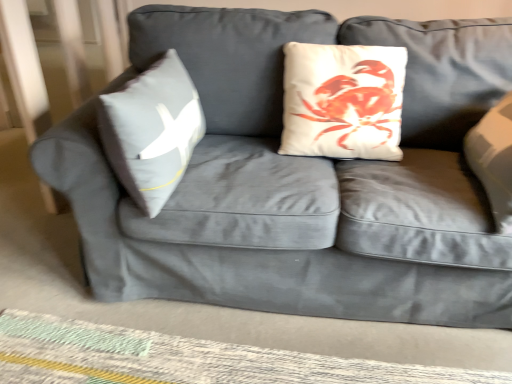
Question: In the image, is woven fabric mat at lower center on the left side or the right side of gray fabric pillow at left?

Choices:
 (A) right
 (B) left

Answer: (A)

Question: From the image's perspective, is woven fabric mat at lower center positioned above or below gray fabric pillow at left?

Choices:
 (A) above
 (B) below

Answer: (B)

Question: Considering the positions of woven fabric mat at lower center and gray fabric pillow at left in the image, is woven fabric mat at lower center bigger or smaller than gray fabric pillow at left?

Choices:
 (A) small
 (B) big

Answer: (A)

Question: Considering the positions of point (170, 74) and point (89, 382), is point (170, 74) closer or farther from the camera than point (89, 382)?

Choices:
 (A) farther
 (B) closer

Answer: (A)

Question: In the image, is gray fabric pillow at left positioned in front of or behind woven fabric mat at lower center?

Choices:
 (A) front
 (B) behind

Answer: (A)

Question: Considering the positions of gray fabric pillow at left and woven fabric mat at lower center in the image, is gray fabric pillow at left wider or thinner than woven fabric mat at lower center?

Choices:
 (A) wide
 (B) thin

Answer: (B)

Question: Considering the positions of gray fabric pillow at left and woven fabric mat at lower center in the image, is gray fabric pillow at left bigger or smaller than woven fabric mat at lower center?

Choices:
 (A) small
 (B) big

Answer: (B)